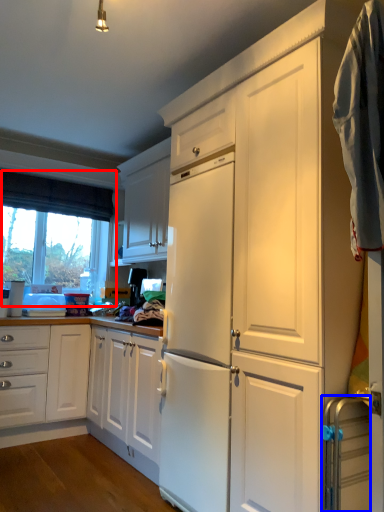
Question: Which of the following is the farthest to the observer, window (highlighted by a red box) or appliance (highlighted by a blue box)?

Choices:
 (A) window
 (B) appliance

Answer: (A)